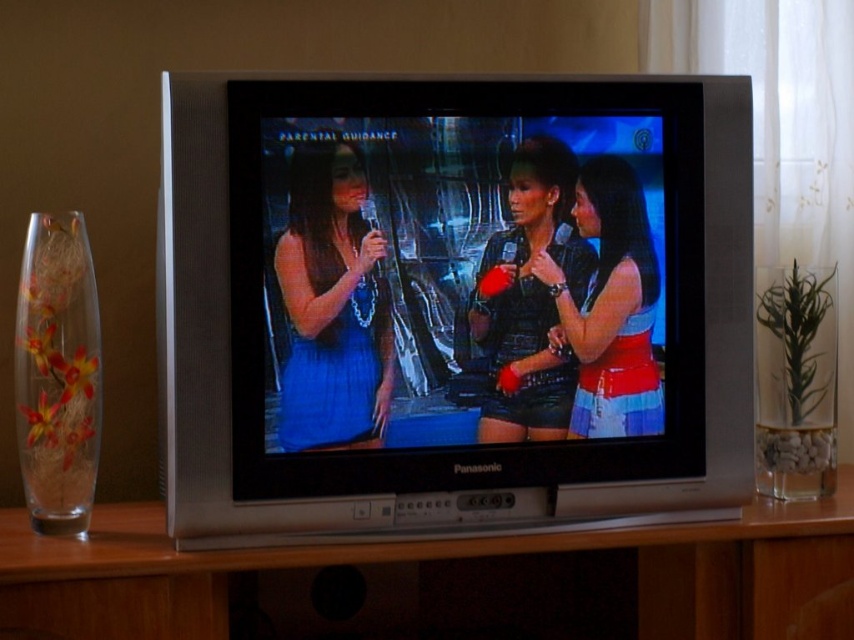
Question: Which point is farther to the camera?

Choices:
 (A) shiny red fabric top at center
 (B) silver metallic entertainment center at center
 (C) shiny black dress at center

Answer: (A)

Question: Is matte blue dress at center to the left of translucent glass vase at left from the viewer's perspective?

Choices:
 (A) no
 (B) yes

Answer: (A)

Question: Is the position of silver metallic entertainment center at center more distant than that of shiny black dress at center?

Choices:
 (A) yes
 (B) no

Answer: (B)

Question: Which point is farther to the camera?

Choices:
 (A) (305, 163)
 (B) (603, 172)
 (C) (519, 392)
 (D) (343, 182)

Answer: (B)

Question: Which point is closer to the camera?

Choices:
 (A) silver metallic entertainment center at center
 (B) shiny black dress at center

Answer: (A)

Question: Does silver metallic flat screen tv at center have a greater width compared to shiny red fabric top at center?

Choices:
 (A) no
 (B) yes

Answer: (B)